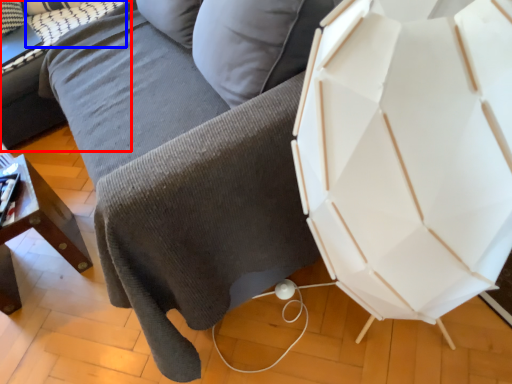
Question: Which object is further to the camera taking this photo, table (highlighted by a red box) or pillow (highlighted by a blue box)?

Choices:
 (A) table
 (B) pillow

Answer: (B)